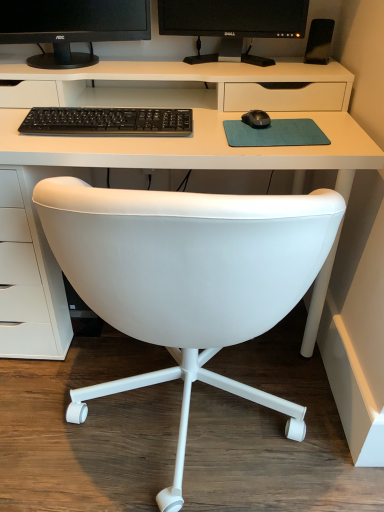
You are a GUI agent. You are given a task and a screenshot of the screen. Output one action in this format:
    pyautogui.click(x=<x>, y=<y>)
    Task: Click on the blank area beneath white leather chair at center (from a real-world perspective)
    The image size is (384, 512).
    Given the screenshot: What is the action you would take?
    pyautogui.click(x=195, y=417)